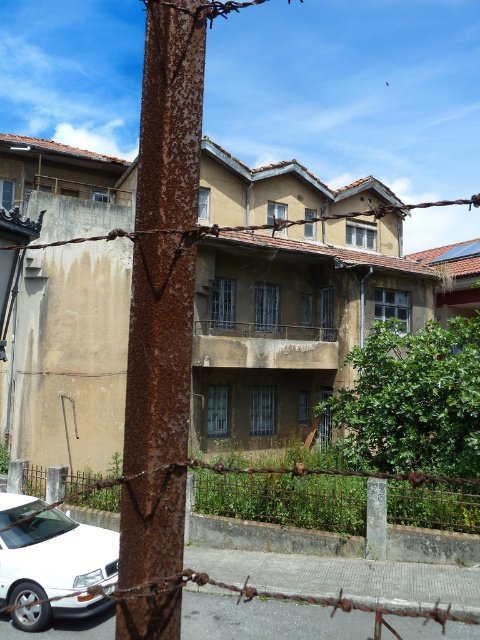
Question: Does rusty metal fence at center appear on the right side of rusty wire at upper center?

Choices:
 (A) yes
 (B) no

Answer: (B)

Question: Which of the following is the farthest from the observer?

Choices:
 (A) rusty wire at upper center
 (B) white matte car at lower left

Answer: (B)

Question: Among these points, which one is farthest from the camera?

Choices:
 (A) (108, 230)
 (B) (351, 476)

Answer: (A)

Question: Does white matte car at lower left lie behind rusty wire at upper center?

Choices:
 (A) yes
 (B) no

Answer: (A)

Question: Which point is farther to the camera?

Choices:
 (A) white matte car at lower left
 (B) rusty metal fence at center

Answer: (B)

Question: Does rusty metal fence at center lie in front of white matte car at lower left?

Choices:
 (A) yes
 (B) no

Answer: (B)